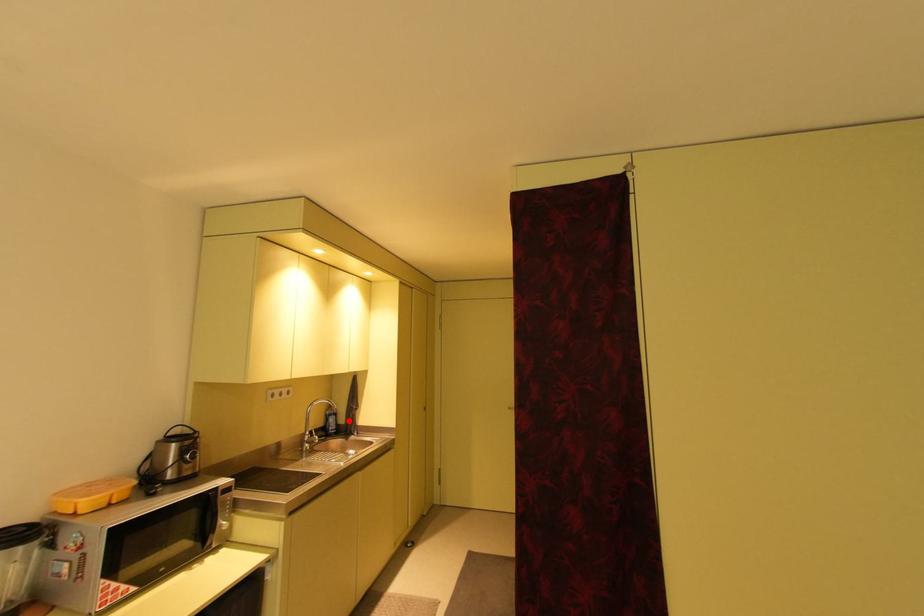
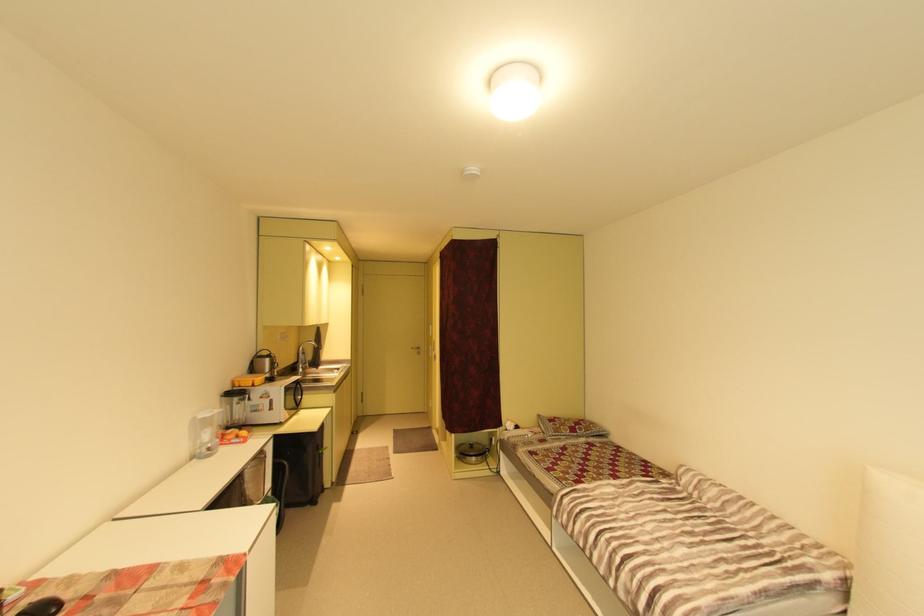
Question: I am providing you with two images of the same scene from different viewpoints. Given a red point in image1, look at the same physical point in image2. Is it:

Choices:
 (A) Closer to the viewpoint
 (B) Farther from the viewpoint

Answer: (A)